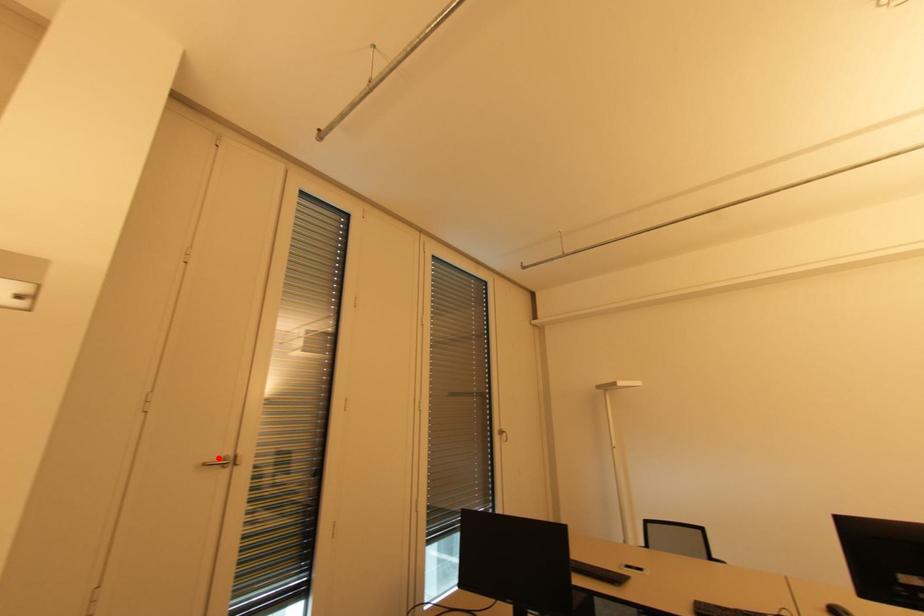
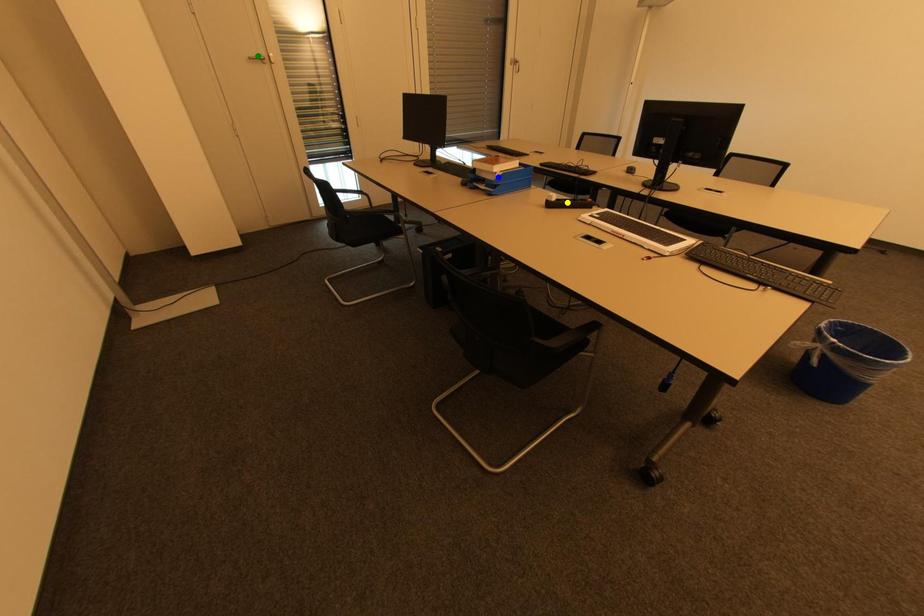
Question: I am providing you with two images of the same scene from different viewpoints. A red point is marked on the first image. You are given multiple points on the second image. Which point in image 2 represents the same 3d spot as the red point in image 1?

Choices:
 (A) blue point
 (B) green point
 (C) yellow point

Answer: (B)